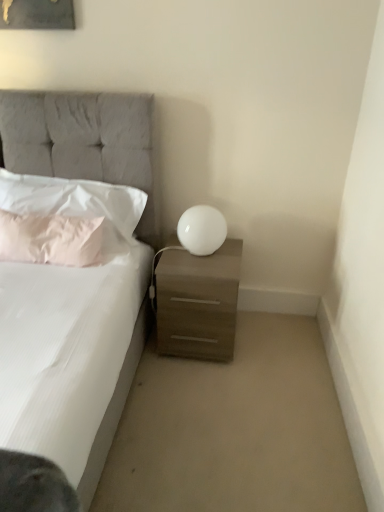
Question: Is white glossy sphere at right touching matte wood nightstand at lower right?

Choices:
 (A) no
 (B) yes

Answer: (A)

Question: Does white glossy sphere at right appear on the right side of matte wood nightstand at lower right?

Choices:
 (A) yes
 (B) no

Answer: (A)

Question: Could matte wood nightstand at lower right be considered to be inside white glossy sphere at right?

Choices:
 (A) no
 (B) yes

Answer: (A)

Question: From the image's perspective, is white glossy sphere at right located beneath matte wood nightstand at lower right?

Choices:
 (A) no
 (B) yes

Answer: (A)

Question: Is matte wood nightstand at lower right at the back of white glossy sphere at right?

Choices:
 (A) no
 (B) yes

Answer: (A)

Question: Is white glossy sphere at right at the left side of matte wood nightstand at lower right?

Choices:
 (A) no
 (B) yes

Answer: (A)

Question: Is pink fabric pillow at left, arranged as the second pillow when viewed from the top, located outside white glossy sphere at right?

Choices:
 (A) no
 (B) yes

Answer: (B)

Question: Considering the relative sizes of pink fabric pillow at left, arranged as the second pillow when viewed from the top, and white glossy sphere at right in the image provided, is pink fabric pillow at left, arranged as the second pillow when viewed from the top, shorter than white glossy sphere at right?

Choices:
 (A) yes
 (B) no

Answer: (B)

Question: Does pink fabric pillow at left, positioned as the 1th pillow in bottom-to-top order, appear on the left side of white glossy sphere at right?

Choices:
 (A) no
 (B) yes

Answer: (B)

Question: Is white glossy sphere at right located within pink fabric pillow at left, arranged as the second pillow when viewed from the top?

Choices:
 (A) yes
 (B) no

Answer: (B)

Question: Does pink fabric pillow at left, arranged as the second pillow when viewed from the top, have a larger size compared to white glossy sphere at right?

Choices:
 (A) yes
 (B) no

Answer: (A)

Question: Does pink fabric pillow at left, arranged as the second pillow when viewed from the top, come in front of white glossy sphere at right?

Choices:
 (A) no
 (B) yes

Answer: (B)

Question: Is white glossy sphere at right to the left of white fabric pillow at left, which ranks as the 1th pillow in top-to-bottom order, from the viewer's perspective?

Choices:
 (A) no
 (B) yes

Answer: (A)